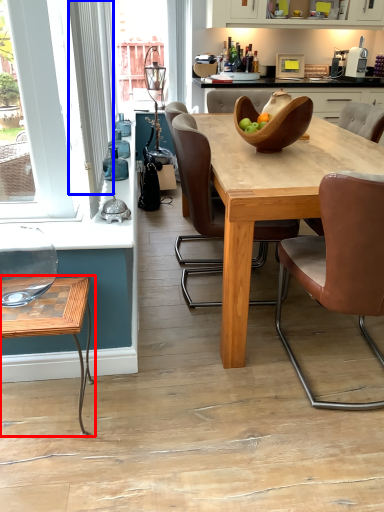
Question: Which point is closer to the camera, coffee table (highlighted by a red box) or curtain (highlighted by a blue box)?

Choices:
 (A) coffee table
 (B) curtain

Answer: (A)